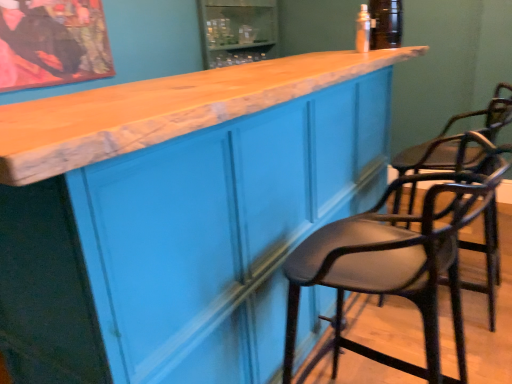
The height and width of the screenshot is (384, 512). Describe the element at coordinates (362, 29) in the screenshot. I see `clear plastic bottle at upper center` at that location.

What is the approximate height of black leather chair at right, which appears as the first chair when viewed from the back?

It is 39.00 inches.

What is the approximate width of black leather chair at right, which appears as the first chair when viewed from the back?

black leather chair at right, which appears as the first chair when viewed from the back, is 21.87 inches in width.

You are a GUI agent. You are given a task and a screenshot of the screen. Output one action in this format:
    pyautogui.click(x=<x>, y=<y>)
    Task: Click on the clear plastic bottle at upper center
    The image size is (512, 384).
    Given the screenshot: What is the action you would take?
    pyautogui.click(x=362, y=29)

From the image's perspective, which is above, clear plastic bottle at upper center or matte black bar stool at right, the 2th chair when ordered from back to front?

clear plastic bottle at upper center.

Is clear plastic bottle at upper center shorter than matte black bar stool at right, the 2th chair when ordered from back to front?

Yes, clear plastic bottle at upper center is shorter than matte black bar stool at right, the 2th chair when ordered from back to front.

Is clear plastic bottle at upper center surrounding matte black bar stool at right, arranged as the first chair when viewed from the front?

Definitely not — matte black bar stool at right, arranged as the first chair when viewed from the front, is not inside clear plastic bottle at upper center.

From a real-world perspective, is clear plastic bottle at upper center under matte black bar stool at right, arranged as the first chair when viewed from the front?

No, from a real-world perspective, clear plastic bottle at upper center is not under matte black bar stool at right, arranged as the first chair when viewed from the front.

Measure the distance from clear plastic bottle at upper center to black leather chair at right, which appears as the first chair when viewed from the back.

A distance of 3.72 feet exists between clear plastic bottle at upper center and black leather chair at right, which appears as the first chair when viewed from the back.

Does clear plastic bottle at upper center have a lesser width compared to black leather chair at right, positioned as the 2th chair in front-to-back order?

Yes, clear plastic bottle at upper center is thinner than black leather chair at right, positioned as the 2th chair in front-to-back order.

From the picture: Would you say clear plastic bottle at upper center is inside or outside black leather chair at right, positioned as the 2th chair in front-to-back order?

clear plastic bottle at upper center lies outside black leather chair at right, positioned as the 2th chair in front-to-back order.

From the image's perspective, starting from the clear plastic bottle at upper center, which chair is the 1st one below? Please provide its 2D coordinates.

[(487, 259)]

From a real-world perspective, is clear plastic bottle at upper center over matte blue cabinet at center?

Correct, in the physical world, clear plastic bottle at upper center is higher than matte blue cabinet at center.

Which point is more distant from viewer, (368,12) or (243,272)?

Positioned behind is point (368,12).

Based on the photo, is clear plastic bottle at upper center not inside matte blue cabinet at center?

Indeed, clear plastic bottle at upper center is completely outside matte blue cabinet at center.

How much distance is there between clear plastic bottle at upper center and matte blue cabinet at center?

A distance of 3.68 feet exists between clear plastic bottle at upper center and matte blue cabinet at center.

Considering the relative sizes of matte black bar stool at right, the 2th chair when ordered from back to front, and clear plastic bottle at upper center in the image provided, is matte black bar stool at right, the 2th chair when ordered from back to front, thinner than clear plastic bottle at upper center?

No, matte black bar stool at right, the 2th chair when ordered from back to front, is not thinner than clear plastic bottle at upper center.

Is matte black bar stool at right, the 2th chair when ordered from back to front, placed right next to clear plastic bottle at upper center?

No.

From their relative heights in the image, would you say matte black bar stool at right, the 2th chair when ordered from back to front, is taller or shorter than clear plastic bottle at upper center?

Clearly, matte black bar stool at right, the 2th chair when ordered from back to front, is taller compared to clear plastic bottle at upper center.

How many degrees apart are the facing directions of black leather chair at right, positioned as the 2th chair in front-to-back order, and matte black bar stool at right, the 2th chair when ordered from back to front?

0.00102 degrees separate the facing orientations of black leather chair at right, positioned as the 2th chair in front-to-back order, and matte black bar stool at right, the 2th chair when ordered from back to front.

From the image's perspective, between black leather chair at right, which appears as the first chair when viewed from the back, and matte black bar stool at right, the 2th chair when ordered from back to front, who is located below?

From the image's view, matte black bar stool at right, the 2th chair when ordered from back to front, is below.

Is point (492, 241) positioned before point (430, 349)?

That is False.

From a real-world perspective, is black leather chair at right, positioned as the 2th chair in front-to-back order, above or below matte black bar stool at right, arranged as the first chair when viewed from the front?

In terms of real-world spatial position, black leather chair at right, positioned as the 2th chair in front-to-back order, is above matte black bar stool at right, arranged as the first chair when viewed from the front.

Considering the positions of objects black leather chair at right, positioned as the 2th chair in front-to-back order, and clear plastic bottle at upper center in the image provided, who is more to the right, black leather chair at right, positioned as the 2th chair in front-to-back order, or clear plastic bottle at upper center?

black leather chair at right, positioned as the 2th chair in front-to-back order, is more to the right.

Is point (481, 171) closer or farther from the camera than point (362, 25)?

Point (481, 171) appears to be closer to the viewer than point (362, 25).

From the image's perspective, who appears lower, black leather chair at right, positioned as the 2th chair in front-to-back order, or clear plastic bottle at upper center?

black leather chair at right, positioned as the 2th chair in front-to-back order, appears lower in the image.

Looking at this image, which of these two, black leather chair at right, positioned as the 2th chair in front-to-back order, or clear plastic bottle at upper center, is smaller?

clear plastic bottle at upper center is smaller.

Is matte blue cabinet at center aimed at matte black bar stool at right, the 2th chair when ordered from back to front?

Yes, matte blue cabinet at center is aimed at matte black bar stool at right, the 2th chair when ordered from back to front.

Measure the distance from matte blue cabinet at center to matte black bar stool at right, arranged as the first chair when viewed from the front.

matte blue cabinet at center is 37.48 centimeters from matte black bar stool at right, arranged as the first chair when viewed from the front.

Between matte blue cabinet at center and matte black bar stool at right, the 2th chair when ordered from back to front, which one appears on the left side from the viewer's perspective?

Positioned to the left is matte blue cabinet at center.

Which of these two, matte blue cabinet at center or matte black bar stool at right, the 2th chair when ordered from back to front, is wider?

With larger width is matte blue cabinet at center.

Where is `bottle to the right of matte black bar stool at right, the 2th chair when ordered from back to front`? bottle to the right of matte black bar stool at right, the 2th chair when ordered from back to front is located at coordinates (362, 29).

You are a GUI agent. You are given a task and a screenshot of the screen. Output one action in this format:
    pyautogui.click(x=<x>, y=<y>)
    Task: Click on the bottle to the left of black leather chair at right, which appears as the first chair when viewed from the back
    This screenshot has width=512, height=384.
    Given the screenshot: What is the action you would take?
    pyautogui.click(x=362, y=29)

Based on their spatial positions, is clear plastic bottle at upper center or black leather chair at right, which appears as the first chair when viewed from the back, further from matte blue cabinet at center?

The object further to matte blue cabinet at center is black leather chair at right, which appears as the first chair when viewed from the back.

Based on their spatial positions, is matte black bar stool at right, arranged as the first chair when viewed from the front, or black leather chair at right, which appears as the first chair when viewed from the back, further from clear plastic bottle at upper center?

Among the two, black leather chair at right, which appears as the first chair when viewed from the back, is located further to clear plastic bottle at upper center.

From the image, which object appears to be farther from matte black bar stool at right, arranged as the first chair when viewed from the front, clear plastic bottle at upper center or black leather chair at right, which appears as the first chair when viewed from the back?

Among the two, clear plastic bottle at upper center is located further to matte black bar stool at right, arranged as the first chair when viewed from the front.

Considering their positions, is black leather chair at right, positioned as the 2th chair in front-to-back order, positioned closer to matte black bar stool at right, the 2th chair when ordered from back to front, than clear plastic bottle at upper center?

Based on the image, black leather chair at right, positioned as the 2th chair in front-to-back order, appears to be nearer to matte black bar stool at right, the 2th chair when ordered from back to front.

When comparing their distances from matte black bar stool at right, arranged as the first chair when viewed from the front, does clear plastic bottle at upper center or matte blue cabinet at center seem closer?

The object closer to matte black bar stool at right, arranged as the first chair when viewed from the front, is matte blue cabinet at center.

Looking at the image, which one is located further to matte blue cabinet at center, clear plastic bottle at upper center or matte black bar stool at right, the 2th chair when ordered from back to front?

clear plastic bottle at upper center is positioned further to the anchor matte blue cabinet at center.

From the picture: Based on their spatial positions, is matte blue cabinet at center or clear plastic bottle at upper center further from matte black bar stool at right, arranged as the first chair when viewed from the front?

clear plastic bottle at upper center lies further to matte black bar stool at right, arranged as the first chair when viewed from the front, than the other object.

Considering their positions, is matte blue cabinet at center positioned further to clear plastic bottle at upper center than matte black bar stool at right, the 2th chair when ordered from back to front?

The object further to clear plastic bottle at upper center is matte blue cabinet at center.

This screenshot has height=384, width=512. I want to click on chair positioned between matte blue cabinet at center and black leather chair at right, which appears as the first chair when viewed from the back, from near to far, so click(395, 263).

The height and width of the screenshot is (384, 512). What are the coordinates of `chair positioned between matte black bar stool at right, the 2th chair when ordered from back to front, and clear plastic bottle at upper center from near to far` in the screenshot? It's located at (487, 259).